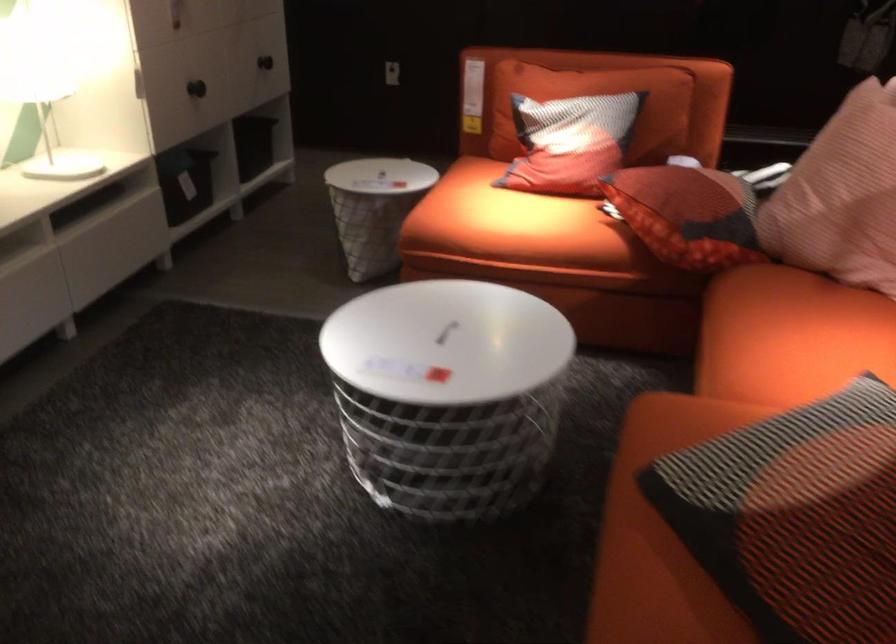
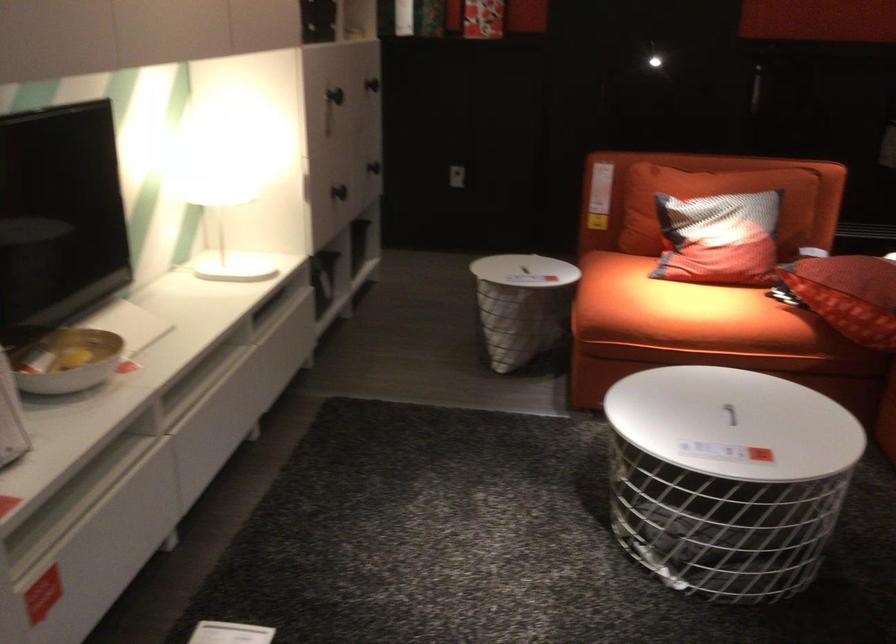
Locate, in the second image, the point that corresponds to pixel 376 175 in the first image.

(522, 270)